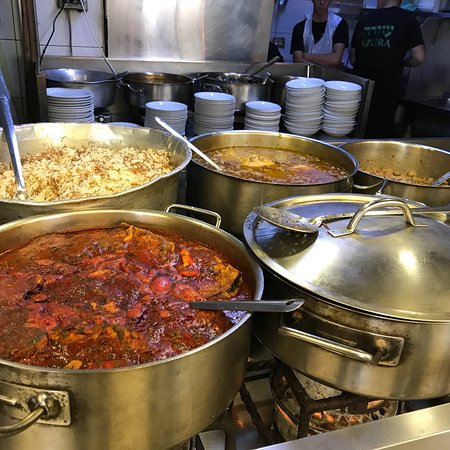
The height and width of the screenshot is (450, 450). Find the location of `white bowls`. white bowls is located at coordinates (343, 92), (296, 112).